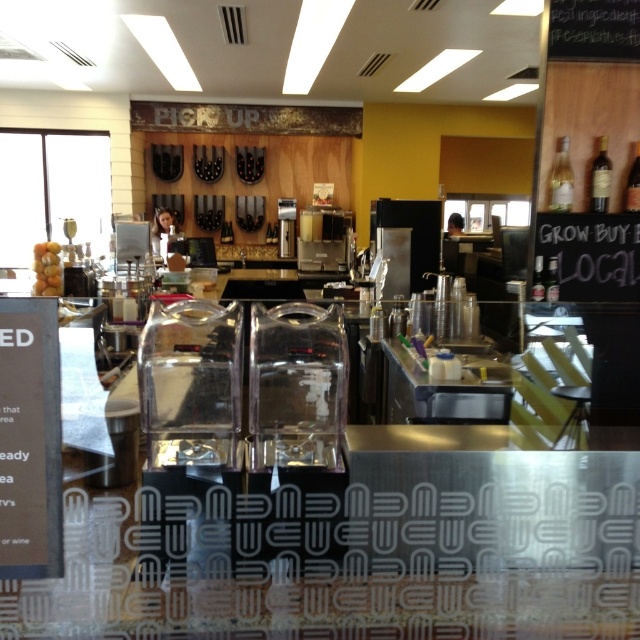
Question: Which point is farther to the camera?

Choices:
 (A) (38, 291)
 (B) (60, 538)

Answer: (A)

Question: Does black paper menu at lower left appear under yellow matte grapes at left?

Choices:
 (A) yes
 (B) no

Answer: (A)

Question: Is black paper menu at lower left smaller than yellow matte grapes at left?

Choices:
 (A) yes
 (B) no

Answer: (A)

Question: Is black paper menu at lower left bigger than yellow matte grapes at left?

Choices:
 (A) yes
 (B) no

Answer: (B)

Question: Which point appears closest to the camera in this image?

Choices:
 (A) (49, 282)
 (B) (12, 500)

Answer: (B)